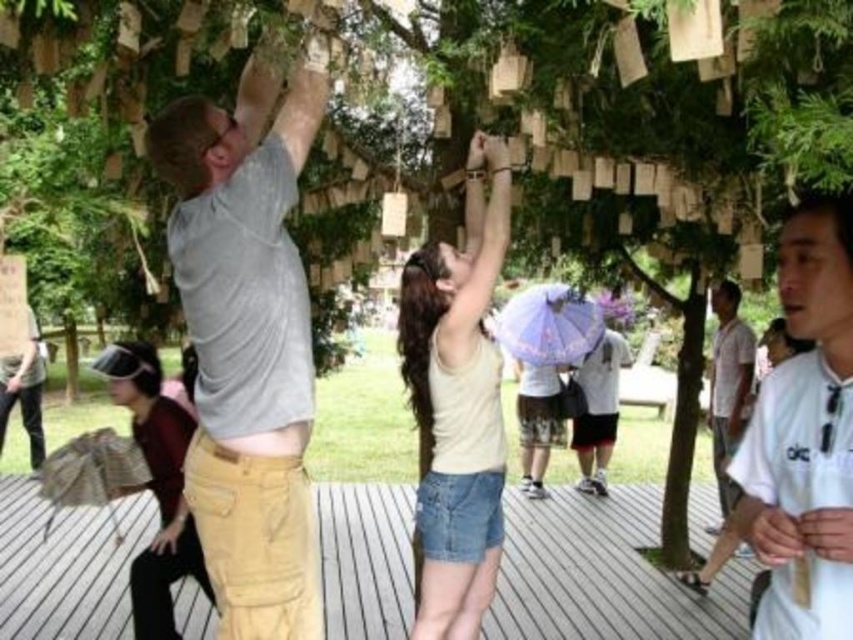
You are a photographer trying to capture a closeup of the khaki pants at upper center and the light beige tank top at center. Which clothing item should you zoom in on more to ensure both are in focus?

The khaki pants at upper center is smaller in size compared to the light beige tank top at center, so you should zoom in more on the khaki pants at upper center to ensure both are in focus.

Based on the scene description, can you determine the spatial relationship between the white cotton shirt at right and the matte purple umbrella at center?

The white cotton shirt at right is located to the right of the matte purple umbrella at center.

You are a photographer trying to capture a clear shot of both the white matte shirt at center and the light beige tank top at center. Since you want to ensure both are fully visible in the frame, which person should you position closer to the camera to avoid being blocked by the other?

The white matte shirt at center is not as tall as light beige tank top at center, so you should position the white matte shirt at center closer to the camera to avoid being blocked by the taller light beige tank top at center.